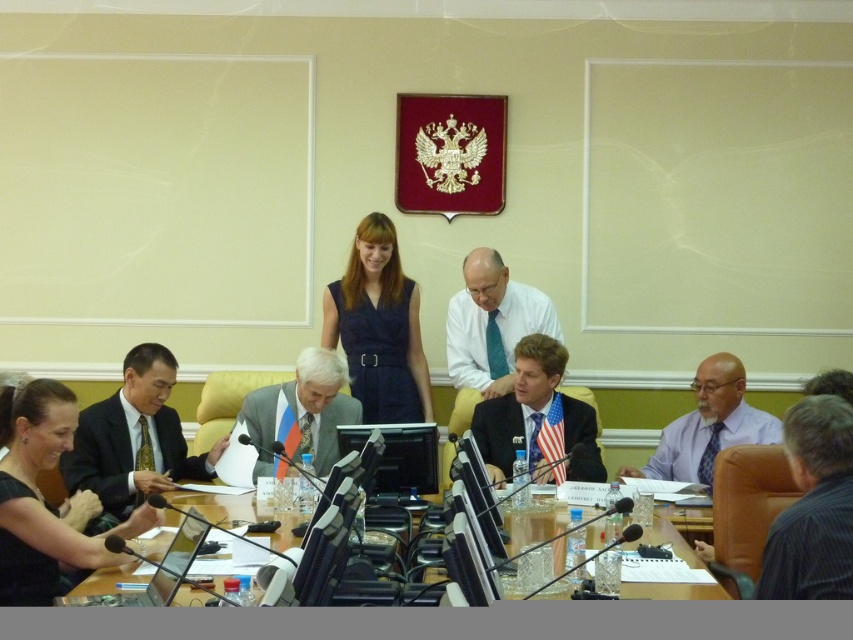
Can you confirm if dark suit at center is shorter than wooden table at center?

No, dark suit at center is not shorter than wooden table at center.

Which is in front, point (148, 404) or point (178, 499)?

Point (178, 499) is in front.

Describe the element at coordinates (134, 436) in the screenshot. I see `dark suit at center` at that location.

Locate an element on the screen. dark suit at center is located at coordinates (134, 436).

Does point (846, 504) lie in front of point (686, 433)?

Yes.

Is point (843, 516) positioned after point (724, 444)?

No, it is not.

Find the location of a particular element. The height and width of the screenshot is (640, 853). striped shirt at lower right is located at coordinates (813, 506).

Is black dress at lower left above dark suit at center?

Yes, black dress at lower left is above dark suit at center.

Locate an element on the screen. black dress at lower left is located at coordinates (38, 497).